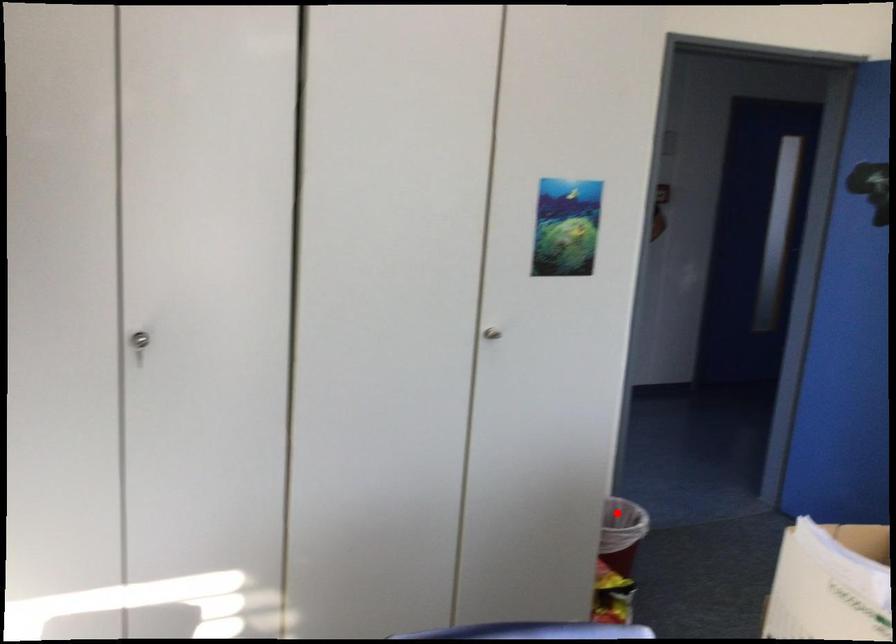
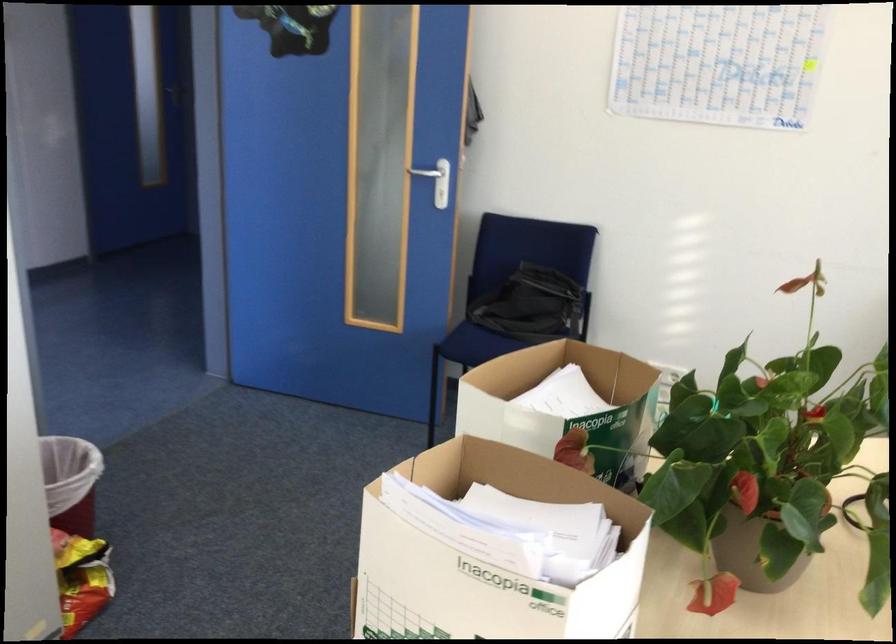
Question: I am providing you with two images of the same scene from different viewpoints. A red point is marked on the first image. Is the red point's position out of view in image 2?

Choices:
 (A) Yes
 (B) No

Answer: (B)